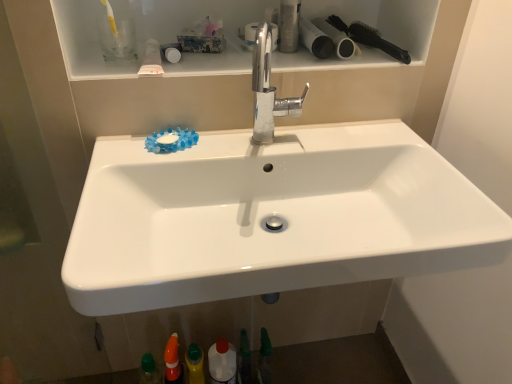
Identify the location of yellow matte bottle at lower center, positioned as the second toiletry in left-to-right order. This screenshot has width=512, height=384. (195, 364).

Image resolution: width=512 pixels, height=384 pixels. Describe the element at coordinates (265, 358) in the screenshot. I see `green matte toothpaste at lower center, marked as the 2th toiletry in a top-to-bottom arrangement` at that location.

Measure the distance between point (221, 377) and camera.

Point (221, 377) and camera are 1.28 meters apart from each other.

Measure the distance between white glossy bottle at lower center and camera.

white glossy bottle at lower center is 4.19 feet from camera.

Locate an element on the screen. This screenshot has height=384, width=512. black matte toilet paper at upper right, the first toilet paper when ordered from right to left is located at coordinates (337, 39).

Where is `chrome metallic faucet at center`? chrome metallic faucet at center is located at coordinates (268, 91).

Considering the sizes of black matte toilet paper at upper right, the first toilet paper when ordered from right to left, and black plastic brush at upper right in the image, is black matte toilet paper at upper right, the first toilet paper when ordered from right to left, taller or shorter than black plastic brush at upper right?

In the image, black matte toilet paper at upper right, the first toilet paper when ordered from right to left, appears to be shorter than black plastic brush at upper right.

Between black matte toilet paper at upper right, the first toilet paper when ordered from right to left, and black plastic brush at upper right, which one has larger size?

black plastic brush at upper right is bigger.

Which point is more forward, (342, 43) or (342, 23)?

The point (342, 43) is more forward.

Would you say chrome metallic faucet at center contains green matte bottle at lower center, which appears as the third toiletry when viewed from the top?

Definitely not — green matte bottle at lower center, which appears as the third toiletry when viewed from the top, is not inside chrome metallic faucet at center.

Is chrome metallic faucet at center taller than green matte bottle at lower center, which appears as the 3th toiletry when viewed from the left?

No.

From the image's perspective, between chrome metallic faucet at center and green matte bottle at lower center, arranged as the third toiletry when viewed from the right, which one is located above?

chrome metallic faucet at center, from the image's perspective.

Is point (262, 351) in front of point (172, 356)?

No, (262, 351) is behind (172, 356).

Is green matte toothpaste at lower center, the 4th toiletry in the left-to-right sequence, oriented away from orange plastic cone at lower center, the fourth toiletry from the top?

No, green matte toothpaste at lower center, the 4th toiletry in the left-to-right sequence, is not facing away from orange plastic cone at lower center, the fourth toiletry from the top.

Based on their sizes in the image, would you say green matte toothpaste at lower center, positioned as the 2th toiletry in right-to-left order, is bigger or smaller than orange plastic cone at lower center, positioned as the fifth toiletry in right-to-left order?

Considering their sizes, green matte toothpaste at lower center, positioned as the 2th toiletry in right-to-left order, takes up less space than orange plastic cone at lower center, positioned as the fifth toiletry in right-to-left order.

Relative to orange plastic cone at lower center, the second toiletry ordered from the bottom, is green matte toothpaste at lower center, marked as the 2th toiletry in a top-to-bottom arrangement, in front or behind?

green matte toothpaste at lower center, marked as the 2th toiletry in a top-to-bottom arrangement, is positioned farther from the viewer than orange plastic cone at lower center, the second toiletry ordered from the bottom.

Considering their positions, is metallic cylindrical container at upper center, the 5th toiletry positioned from the left, located in front of or behind chrome metallic faucet at center?

In the image, metallic cylindrical container at upper center, the 5th toiletry positioned from the left, appears behind chrome metallic faucet at center.

How different are the orientations of metallic cylindrical container at upper center, positioned as the fifth toiletry in bottom-to-top order, and chrome metallic faucet at center in degrees?

They differ by 6.74 degrees in their facing directions.

Consider the image. From a real-world perspective, does metallic cylindrical container at upper center, the 5th toiletry positioned from the left, sit lower than chrome metallic faucet at center?

No, from a real-world perspective, metallic cylindrical container at upper center, the 5th toiletry positioned from the left, is not beneath chrome metallic faucet at center.

Which object is positioned more to the right, metallic cylindrical container at upper center, positioned as the fifth toiletry in bottom-to-top order, or chrome metallic faucet at center?

metallic cylindrical container at upper center, positioned as the fifth toiletry in bottom-to-top order, is more to the right.

Is green matte bottle at lower center, which ranks as the 3th toiletry in bottom-to-top order, turned away from green matte toothpaste at lower center, marked as the 2th toiletry in a top-to-bottom arrangement?

No, green matte bottle at lower center, which ranks as the 3th toiletry in bottom-to-top order, is not facing the opposite direction of green matte toothpaste at lower center, marked as the 2th toiletry in a top-to-bottom arrangement.

Based on the photo, does green matte bottle at lower center, which appears as the third toiletry when viewed from the top, have a greater width compared to green matte toothpaste at lower center, which is counted as the fourth toiletry, starting from the bottom?

Incorrect, the width of green matte bottle at lower center, which appears as the third toiletry when viewed from the top, does not surpass that of green matte toothpaste at lower center, which is counted as the fourth toiletry, starting from the bottom.

Which of these two, green matte bottle at lower center, arranged as the third toiletry when viewed from the right, or green matte toothpaste at lower center, positioned as the 2th toiletry in right-to-left order, stands shorter?

green matte bottle at lower center, arranged as the third toiletry when viewed from the right, is shorter.

Between green matte bottle at lower center, which ranks as the 3th toiletry in bottom-to-top order, and green matte toothpaste at lower center, the 4th toiletry in the left-to-right sequence, which one is positioned in front?

Positioned in front is green matte bottle at lower center, which ranks as the 3th toiletry in bottom-to-top order.

From a real-world perspective, is black matte toilet paper at upper right, which ranks as the second toilet paper in left-to-right order, positioned under yellow matte bottle at lower center, the fifth toiletry when ordered from top to bottom, based on gravity?

Incorrect, from a real-world perspective, black matte toilet paper at upper right, which ranks as the second toilet paper in left-to-right order, is higher than yellow matte bottle at lower center, the fifth toiletry when ordered from top to bottom.

Is black matte toilet paper at upper right, the first toilet paper when ordered from right to left, to the left of yellow matte bottle at lower center, positioned as the second toiletry in left-to-right order, from the viewer's perspective?

No.

From the image's perspective, count 4th toiletrys downward from the black matte toilet paper at upper right, the first toilet paper when ordered from right to left, and point to it. Please provide its 2D coordinates.

[(195, 364)]

Can you see black matte toilet paper at upper right, which ranks as the second toilet paper in left-to-right order, touching yellow matte bottle at lower center, positioned as the second toiletry in left-to-right order?

No, black matte toilet paper at upper right, which ranks as the second toilet paper in left-to-right order, is not touching yellow matte bottle at lower center, positioned as the second toiletry in left-to-right order.

Can you confirm if green matte bottle at lower center, arranged as the third toiletry when viewed from the right, is wider than yellow matte bottle at lower center, arranged as the first toiletry when ordered from the bottom?

Incorrect, the width of green matte bottle at lower center, arranged as the third toiletry when viewed from the right, does not surpass that of yellow matte bottle at lower center, arranged as the first toiletry when ordered from the bottom.

From the image's perspective, between green matte bottle at lower center, which ranks as the 3th toiletry in bottom-to-top order, and yellow matte bottle at lower center, arranged as the first toiletry when ordered from the bottom, who is located below?

From the image's view, yellow matte bottle at lower center, arranged as the first toiletry when ordered from the bottom, is below.

Is green matte bottle at lower center, arranged as the third toiletry when viewed from the right, located outside yellow matte bottle at lower center, the fourth toiletry when ordered from right to left?

Indeed, green matte bottle at lower center, arranged as the third toiletry when viewed from the right, is completely outside yellow matte bottle at lower center, the fourth toiletry when ordered from right to left.

Is green matte bottle at lower center, which appears as the third toiletry when viewed from the top, positioned in front of yellow matte bottle at lower center, arranged as the first toiletry when ordered from the bottom?

No, green matte bottle at lower center, which appears as the third toiletry when viewed from the top, is further to the viewer.

Identify the location of toilet paper located underneath the black plastic brush at upper right (from a real-world perspective). This screenshot has width=512, height=384. (337, 39).

Where is `tap that is above the green matte bottle at lower center, which ranks as the 3th toiletry in bottom-to-top order (from a real-world perspective)`? Image resolution: width=512 pixels, height=384 pixels. tap that is above the green matte bottle at lower center, which ranks as the 3th toiletry in bottom-to-top order (from a real-world perspective) is located at coordinates (268, 91).

Considering their positions, is black matte toilet paper at upper right, which ranks as the second toilet paper in left-to-right order, positioned closer to matte white toilet paper at upper right, the 1th toilet paper viewed from the left, than black plastic brush at upper right?

black matte toilet paper at upper right, which ranks as the second toilet paper in left-to-right order, is positioned closer to the anchor matte white toilet paper at upper right, the 1th toilet paper viewed from the left.

Looking at the image, which one is located further to black plastic brush at upper right, metallic cylindrical container at upper center, positioned as the fifth toiletry in bottom-to-top order, or green matte bottle at lower center, which appears as the third toiletry when viewed from the top?

green matte bottle at lower center, which appears as the third toiletry when viewed from the top, is further to black plastic brush at upper right.

Considering their positions, is white glossy sink at center positioned closer to chrome metallic faucet at center than black plastic brush at upper right?

white glossy sink at center is closer to chrome metallic faucet at center.

From the image, which object appears to be farther from metallic cylindrical container at upper center, arranged as the first toiletry when viewed from the top, green matte toothpaste at lower center, positioned as the 2th toiletry in right-to-left order, or white glossy bottle at lower center?

white glossy bottle at lower center.

From the image, which object appears to be nearer to green matte toothpaste at lower center, marked as the 2th toiletry in a top-to-bottom arrangement, white glossy bottle at lower center or chrome metallic faucet at center?

The object closer to green matte toothpaste at lower center, marked as the 2th toiletry in a top-to-bottom arrangement, is white glossy bottle at lower center.

Based on their spatial positions, is orange plastic cone at lower center, the second toiletry ordered from the bottom, or white glossy sink at center closer to yellow matte bottle at lower center, arranged as the first toiletry when ordered from the bottom?

orange plastic cone at lower center, the second toiletry ordered from the bottom.

Estimate the real-world distances between objects in this image. Which object is further from black plastic brush at upper right, matte white toilet paper at upper right, the 1th toilet paper viewed from the left, or white glossy bottle at lower center?

Based on the image, white glossy bottle at lower center appears to be further to black plastic brush at upper right.

From the image, which object appears to be farther from black plastic brush at upper right, white glossy bottle at lower center or metallic cylindrical container at upper center, arranged as the first toiletry when viewed from the top?

white glossy bottle at lower center lies further to black plastic brush at upper right than the other object.

Find the location of `tap between metallic cylindrical container at upper center, positioned as the fifth toiletry in bottom-to-top order, and green matte bottle at lower center, arranged as the third toiletry when viewed from the right, from top to bottom`. tap between metallic cylindrical container at upper center, positioned as the fifth toiletry in bottom-to-top order, and green matte bottle at lower center, arranged as the third toiletry when viewed from the right, from top to bottom is located at coordinates (268, 91).

Find the location of a particular element. Image resolution: width=512 pixels, height=384 pixels. sink between matte white toilet paper at upper right, the 1th toilet paper viewed from the left, and white glossy bottle at lower center from top to bottom is located at coordinates (269, 215).

Where is `sink between chrome metallic faucet at center and yellow matte bottle at lower center, the fifth toiletry when ordered from top to bottom, in the up-down direction`? sink between chrome metallic faucet at center and yellow matte bottle at lower center, the fifth toiletry when ordered from top to bottom, in the up-down direction is located at coordinates (269, 215).

Locate an element on the screen. This screenshot has height=384, width=512. tap between black plastic brush at upper right and green matte bottle at lower center, arranged as the third toiletry when viewed from the right, in the vertical direction is located at coordinates (268, 91).